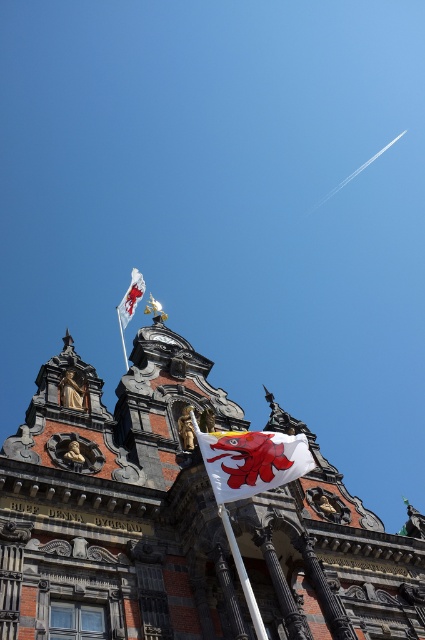
You are a drone operator tasked with photographing two white fabric flags on a historic building. The flags are labeled as the white fabric flag at center and the white fabric flag at upper center. Your drone has a camera with a 50 meter range. Can your drone capture both flags in a single photo without moving the drone?

The white fabric flag at center and the white fabric flag at upper center are 52.89 meters apart from each other. Since the drone camera has a 50 meter range, the distance between the flags exceeds the camera range. Therefore, the drone cannot capture both flags in a single photo without moving the drone.